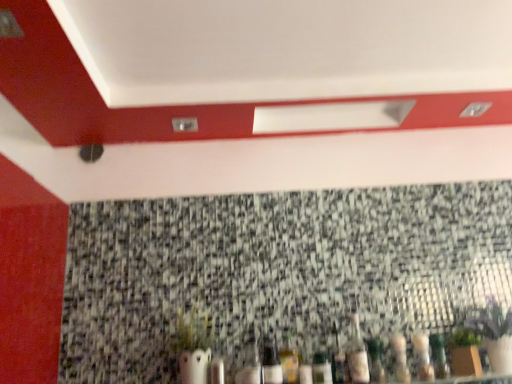
Question: Is clear glass bottle at center, acting as the seventh bottle starting from the right, at the back of granite mosaic at center?

Choices:
 (A) yes
 (B) no

Answer: (A)

Question: Is granite mosaic at center aimed at clear glass bottle at center, acting as the seventh bottle starting from the right?

Choices:
 (A) yes
 (B) no

Answer: (A)

Question: Is granite mosaic at center completely or partially outside of clear glass bottle at center, which appears as the 1th bottle when viewed from the left?

Choices:
 (A) yes
 (B) no

Answer: (A)

Question: Could clear glass bottle at center, acting as the seventh bottle starting from the right, be considered to be inside granite mosaic at center?

Choices:
 (A) no
 (B) yes

Answer: (A)

Question: From a real-world perspective, is granite mosaic at center over clear glass bottle at center, acting as the seventh bottle starting from the right?

Choices:
 (A) yes
 (B) no

Answer: (A)

Question: Would you say clear glass bottle at center, the fourth bottle in the left-to-right sequence, is to the left or to the right of granite mosaic at center in the picture?

Choices:
 (A) left
 (B) right

Answer: (B)

Question: Is clear glass bottle at center, which ranks as the fourth bottle in right-to-left order, wider or thinner than granite mosaic at center?

Choices:
 (A) thin
 (B) wide

Answer: (B)

Question: Is clear glass bottle at center, the fourth bottle in the left-to-right sequence, situated inside granite mosaic at center or outside?

Choices:
 (A) inside
 (B) outside

Answer: (B)

Question: From their relative heights in the image, would you say clear glass bottle at center, the fourth bottle in the left-to-right sequence, is taller or shorter than granite mosaic at center?

Choices:
 (A) short
 (B) tall

Answer: (A)

Question: From the image's perspective, is translucent glass bottle at lower right, the 2th bottle when ordered from right to left, located above or below translucent glass bottle at lower center, the second bottle when ordered from left to right?

Choices:
 (A) above
 (B) below

Answer: (A)

Question: From their relative heights in the image, would you say translucent glass bottle at lower right, which is the 6th bottle in left-to-right order, is taller or shorter than translucent glass bottle at lower center, arranged as the 6th bottle when viewed from the right?

Choices:
 (A) tall
 (B) short

Answer: (A)

Question: Looking at their shapes, would you say translucent glass bottle at lower right, which is the 6th bottle in left-to-right order, is wider or thinner than translucent glass bottle at lower center, the second bottle when ordered from left to right?

Choices:
 (A) thin
 (B) wide

Answer: (B)

Question: From a real-world perspective, relative to translucent glass bottle at lower center, arranged as the 6th bottle when viewed from the right, is translucent glass bottle at lower right, the 2th bottle when ordered from right to left, vertically above or below?

Choices:
 (A) above
 (B) below

Answer: (A)

Question: Considering the positions of translucent glass bottle at lower right, the 2th bottle when ordered from right to left, and clear glass bottle at center, which appears as the 1th bottle when viewed from the left, in the image, is translucent glass bottle at lower right, the 2th bottle when ordered from right to left, taller or shorter than clear glass bottle at center, which appears as the 1th bottle when viewed from the left,?

Choices:
 (A) short
 (B) tall

Answer: (B)

Question: Considering the positions of translucent glass bottle at lower right, the 2th bottle when ordered from right to left, and clear glass bottle at center, acting as the seventh bottle starting from the right, in the image, is translucent glass bottle at lower right, the 2th bottle when ordered from right to left, wider or thinner than clear glass bottle at center, acting as the seventh bottle starting from the right,?

Choices:
 (A) wide
 (B) thin

Answer: (A)